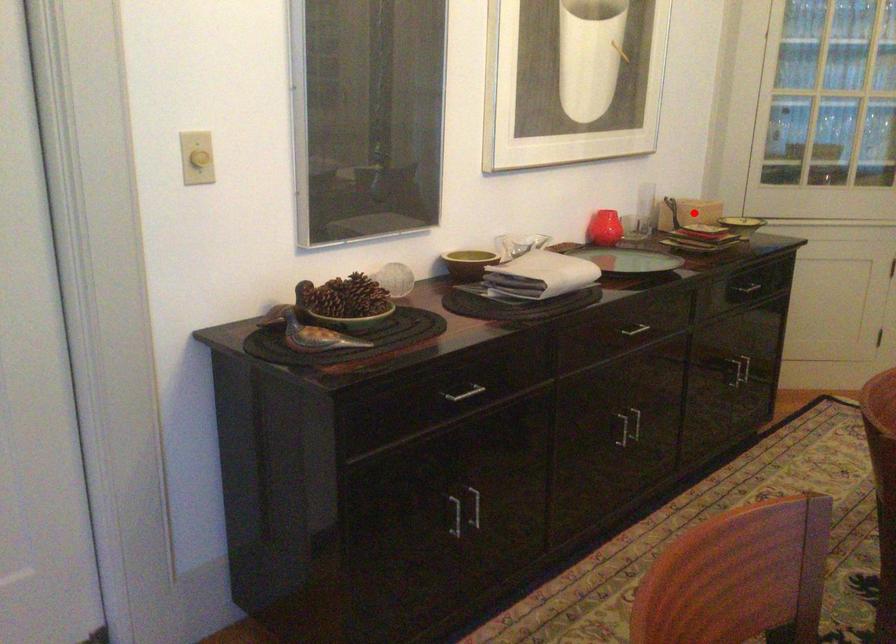
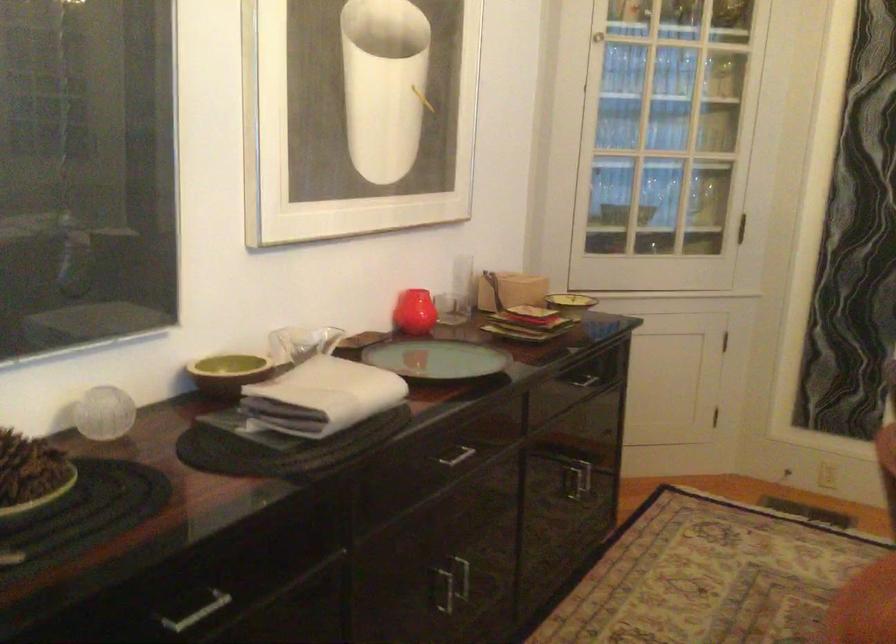
Question: I am providing you with two images of the same scene from different viewpoints. Image1 has a red point marked. In image2, the corresponding 3D location appears at what relative position? Reply with the corresponding letter.

Choices:
 (A) Closer
 (B) Farther

Answer: (A)